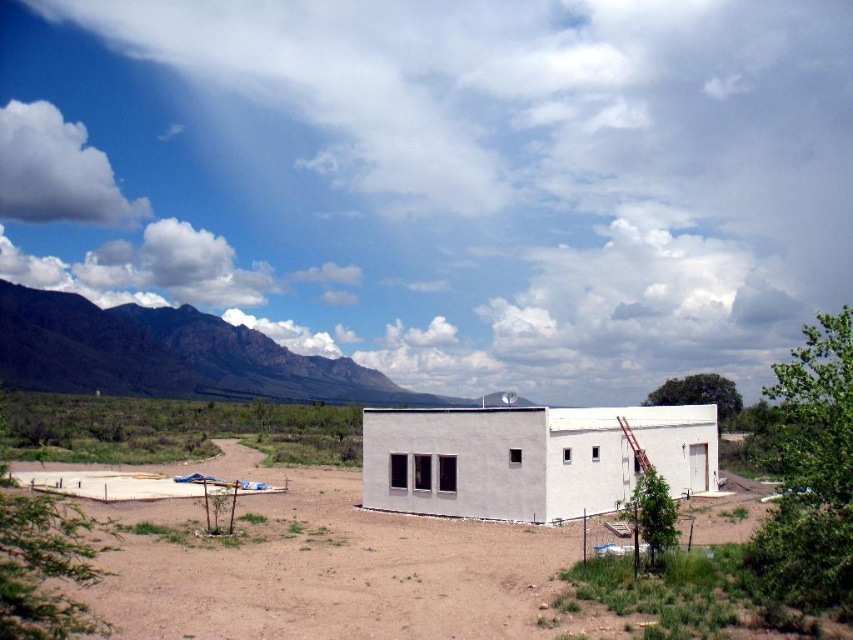
Question: Is dirt at center closer to camera compared to gray rocky mountain at left?

Choices:
 (A) yes
 (B) no

Answer: (A)

Question: Among these objects, which one is nearest to the camera?

Choices:
 (A) white smooth building at center
 (B) gray rocky mountain at left
 (C) dirt at center

Answer: (C)

Question: Which point is closer to the camera?

Choices:
 (A) (180, 550)
 (B) (370, 492)
 (C) (113, 364)

Answer: (A)

Question: Which of the following is the farthest from the observer?

Choices:
 (A) (383, 381)
 (B) (746, 481)

Answer: (A)

Question: Considering the relative positions of dirt at center and gray rocky mountain at left in the image provided, where is dirt at center located with respect to gray rocky mountain at left?

Choices:
 (A) right
 (B) left

Answer: (A)

Question: Can you confirm if dirt at center is positioned below gray rocky mountain at left?

Choices:
 (A) yes
 (B) no

Answer: (A)